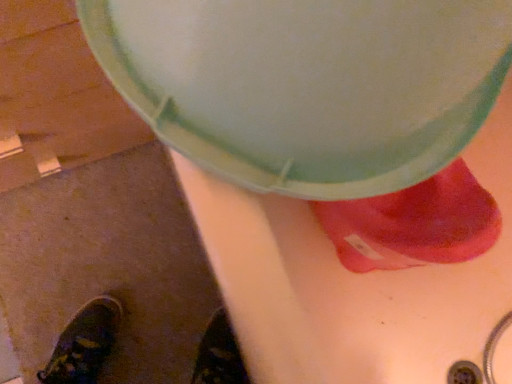
In the scene shown: What is the approximate height of matte pink sock at lower right?

matte pink sock at lower right is 8.82 inches in height.

This screenshot has width=512, height=384. Find the location of `matte pink sock at lower right`. matte pink sock at lower right is located at coordinates (414, 224).

Describe the element at coordinates (414, 224) in the screenshot. I see `matte pink sock at lower right` at that location.

Describe the element at coordinates (308, 84) in the screenshot. This screenshot has height=384, width=512. I see `matte plastic lid at upper center` at that location.

The height and width of the screenshot is (384, 512). I want to click on matte plastic lid at upper center, so click(308, 84).

Locate an element on the screen. The image size is (512, 384). matte pink sock at lower right is located at coordinates tap(414, 224).

In the image, is matte pink sock at lower right on the left side or the right side of matte plastic lid at upper center?

From the image, it's evident that matte pink sock at lower right is to the right of matte plastic lid at upper center.

Consider the image. Which is in front, matte pink sock at lower right or matte plastic lid at upper center?

matte plastic lid at upper center is closer to the camera.

Considering the positions of point (420, 211) and point (499, 27), is point (420, 211) closer or farther from the camera than point (499, 27)?

Point (420, 211) appears to be farther away from the viewer than point (499, 27).

From the image's perspective, between matte pink sock at lower right and matte plastic lid at upper center, who is located below?

matte pink sock at lower right.

From a real-world perspective, is matte pink sock at lower right on matte plastic lid at upper center?

Incorrect, from a real-world perspective, matte pink sock at lower right is lower than matte plastic lid at upper center.

Which of these two, matte pink sock at lower right or matte plastic lid at upper center, is thinner?

matte pink sock at lower right.

Which of these two, matte pink sock at lower right or matte plastic lid at upper center, stands shorter?

Standing shorter between the two is matte pink sock at lower right.

In terms of size, does matte pink sock at lower right appear bigger or smaller than matte plastic lid at upper center?

In the image, matte pink sock at lower right appears to be smaller than matte plastic lid at upper center.

Is matte plastic lid at upper center inside matte pink sock at lower right?

No, matte pink sock at lower right does not contain matte plastic lid at upper center.

Is there a large distance between matte pink sock at lower right and matte plastic lid at upper center?

No.

Is matte pink sock at lower right positioned with its back to matte plastic lid at upper center?

matte pink sock at lower right does not have its back to matte plastic lid at upper center.

How different are the orientations of matte pink sock at lower right and matte plastic lid at upper center in degrees?

They differ by 52.6 degrees in their facing directions.

How far apart are matte pink sock at lower right and matte plastic lid at upper center?

matte pink sock at lower right is 12.80 inches from matte plastic lid at upper center.

Where is `lid in front of the matte pink sock at lower right`? This screenshot has height=384, width=512. lid in front of the matte pink sock at lower right is located at coordinates (308, 84).

In the image, is matte plastic lid at upper center on the left side or the right side of matte pink sock at lower right?

Clearly, matte plastic lid at upper center is on the left of matte pink sock at lower right in the image.

Based on the photo, is matte plastic lid at upper center closer to the viewer compared to matte pink sock at lower right?

That is True.

Which is closer, (238,9) or (362,202)?

Point (238,9).

From the image's perspective, is matte plastic lid at upper center on matte pink sock at lower right?

Yes, from the image's perspective, matte plastic lid at upper center is above matte pink sock at lower right.

From a real-world perspective, is matte plastic lid at upper center positioned over matte pink sock at lower right based on gravity?

Correct, in the physical world, matte plastic lid at upper center is higher than matte pink sock at lower right.

Which of these two, matte plastic lid at upper center or matte pink sock at lower right, is thinner?

Thinner between the two is matte pink sock at lower right.

Which of these two, matte plastic lid at upper center or matte pink sock at lower right, stands shorter?

matte pink sock at lower right.

Who is smaller, matte plastic lid at upper center or matte pink sock at lower right?

Smaller between the two is matte pink sock at lower right.

Would you say matte plastic lid at upper center is outside matte pink sock at lower right?

That's correct, matte plastic lid at upper center is outside of matte pink sock at lower right.

Is matte plastic lid at upper center placed right next to matte pink sock at lower right?

matte plastic lid at upper center and matte pink sock at lower right are clearly separated.

Is matte plastic lid at upper center facing towards matte pink sock at lower right?

No, matte plastic lid at upper center is not oriented towards matte pink sock at lower right.

What's the angular difference between matte plastic lid at upper center and matte pink sock at lower right's facing directions?

matte plastic lid at upper center and matte pink sock at lower right are facing 52.6 degrees away from each other.

How far apart are matte plastic lid at upper center and matte pink sock at lower right?

12.80 inches.

Locate an element on the screen. The height and width of the screenshot is (384, 512). footwear located on the right of matte plastic lid at upper center is located at coordinates (414, 224).

This screenshot has width=512, height=384. I want to click on lid in front of the matte pink sock at lower right, so click(308, 84).

There is a matte pink sock at lower right. What are the coordinates of `lid above it (from a real-world perspective)` in the screenshot? It's located at (308, 84).